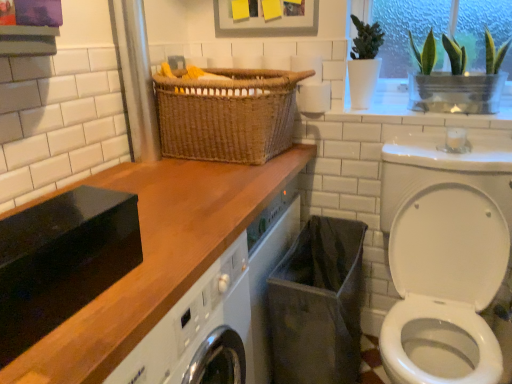
Identify the location of free spot above wooden at upper left (from a real-world perspective). The height and width of the screenshot is (384, 512). (183, 191).